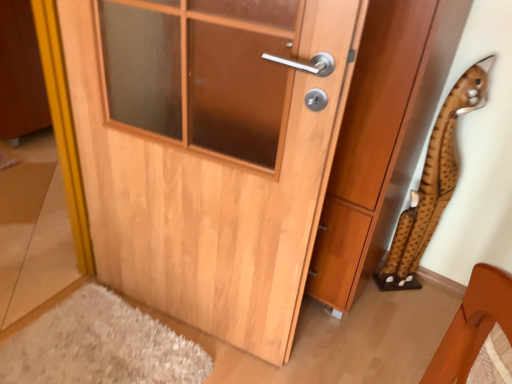
Question: Can you confirm if wooden door at center is positioned to the right of brown spotted plush at right?

Choices:
 (A) yes
 (B) no

Answer: (B)

Question: Does wooden door at center touch brown spotted plush at right?

Choices:
 (A) no
 (B) yes

Answer: (A)

Question: Is wooden door at center aimed at brown spotted plush at right?

Choices:
 (A) yes
 (B) no

Answer: (B)

Question: Is wooden door at center turned away from brown spotted plush at right?

Choices:
 (A) no
 (B) yes

Answer: (A)

Question: From the image's perspective, does wooden door at center appear lower than brown spotted plush at right?

Choices:
 (A) no
 (B) yes

Answer: (A)

Question: Considering the relative sizes of wooden door at center and brown spotted plush at right in the image provided, is wooden door at center wider than brown spotted plush at right?

Choices:
 (A) no
 (B) yes

Answer: (B)

Question: Is brown spotted plush at right to the right of wooden door at center from the viewer's perspective?

Choices:
 (A) yes
 (B) no

Answer: (A)

Question: From the image's perspective, is brown spotted plush at right over wooden door at center?

Choices:
 (A) no
 (B) yes

Answer: (A)

Question: Is brown spotted plush at right aimed at wooden door at center?

Choices:
 (A) yes
 (B) no

Answer: (B)

Question: Does brown spotted plush at right have a larger size compared to wooden door at center?

Choices:
 (A) yes
 (B) no

Answer: (B)

Question: Is wooden door at center surrounded by brown spotted plush at right?

Choices:
 (A) no
 (B) yes

Answer: (A)

Question: Does brown spotted plush at right have a greater width compared to wooden door at center?

Choices:
 (A) no
 (B) yes

Answer: (A)

Question: From the image's perspective, is light wood door at center on top of wooden door at center?

Choices:
 (A) yes
 (B) no

Answer: (B)